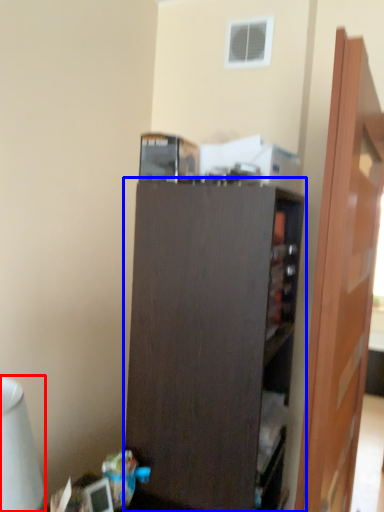
Question: Among these objects, which one is nearest to the camera, table lamp (highlighted by a red box) or cupboard (highlighted by a blue box)?

Choices:
 (A) table lamp
 (B) cupboard

Answer: (A)